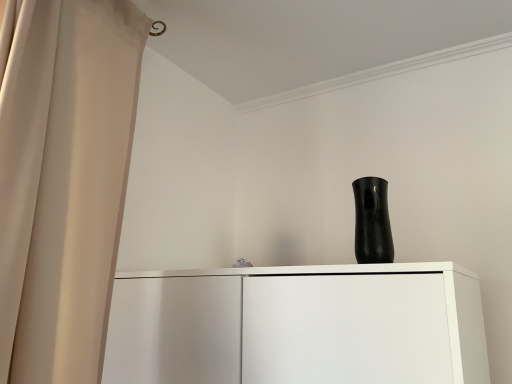
Question: Is black glossy vase at upper center further to camera compared to beige fabric curtain at left?

Choices:
 (A) no
 (B) yes

Answer: (B)

Question: Is black glossy vase at upper center positioned far away from beige fabric curtain at left?

Choices:
 (A) yes
 (B) no

Answer: (B)

Question: Considering the relative sizes of black glossy vase at upper center and beige fabric curtain at left in the image provided, is black glossy vase at upper center thinner than beige fabric curtain at left?

Choices:
 (A) no
 (B) yes

Answer: (B)

Question: Is the surface of black glossy vase at upper center in direct contact with beige fabric curtain at left?

Choices:
 (A) no
 (B) yes

Answer: (A)

Question: Is black glossy vase at upper center positioned beyond the bounds of beige fabric curtain at left?

Choices:
 (A) no
 (B) yes

Answer: (B)

Question: Considering the relative positions of black glossy vase at upper center and beige fabric curtain at left in the image provided, is black glossy vase at upper center to the right of beige fabric curtain at left from the viewer's perspective?

Choices:
 (A) no
 (B) yes

Answer: (B)

Question: Is beige fabric curtain at left directly adjacent to black glossy vase at upper center?

Choices:
 (A) no
 (B) yes

Answer: (A)

Question: Considering the relative sizes of beige fabric curtain at left and black glossy vase at upper center in the image provided, is beige fabric curtain at left thinner than black glossy vase at upper center?

Choices:
 (A) yes
 (B) no

Answer: (B)

Question: From a real-world perspective, is beige fabric curtain at left beneath black glossy vase at upper center?

Choices:
 (A) yes
 (B) no

Answer: (B)

Question: Is beige fabric curtain at left shorter than black glossy vase at upper center?

Choices:
 (A) yes
 (B) no

Answer: (B)

Question: Could you tell me if beige fabric curtain at left is turned towards black glossy vase at upper center?

Choices:
 (A) no
 (B) yes

Answer: (A)

Question: Are beige fabric curtain at left and black glossy vase at upper center located far from each other?

Choices:
 (A) no
 (B) yes

Answer: (A)

Question: In terms of height, does black glossy vase at upper center look taller or shorter compared to beige fabric curtain at left?

Choices:
 (A) short
 (B) tall

Answer: (A)